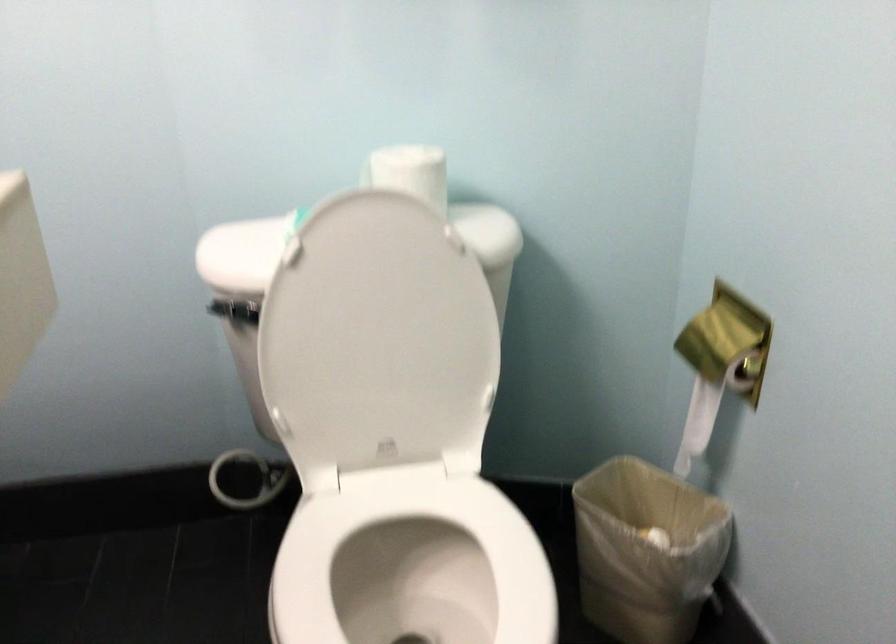
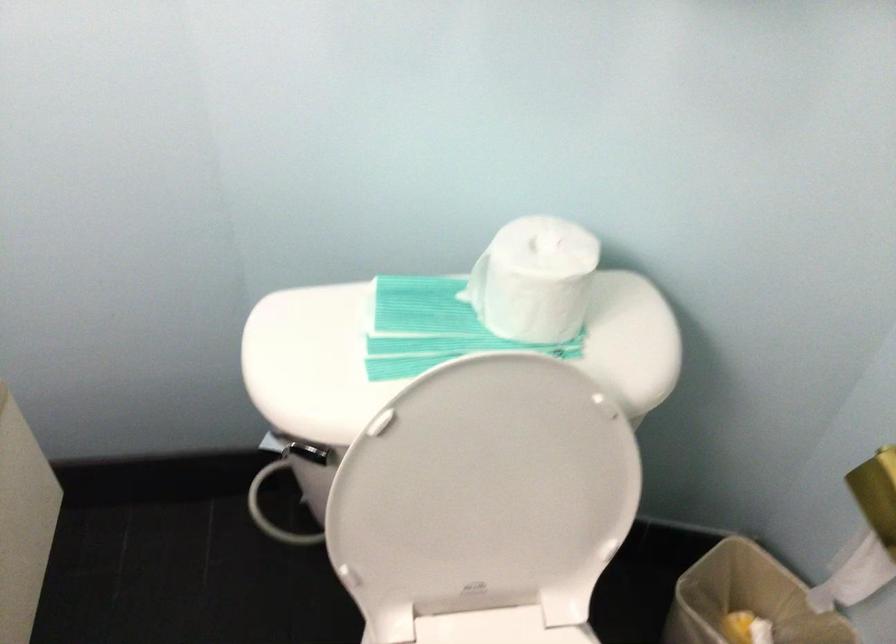
Where in the second image is the point corresponding to pixel 319 221 from the first image?

(415, 308)